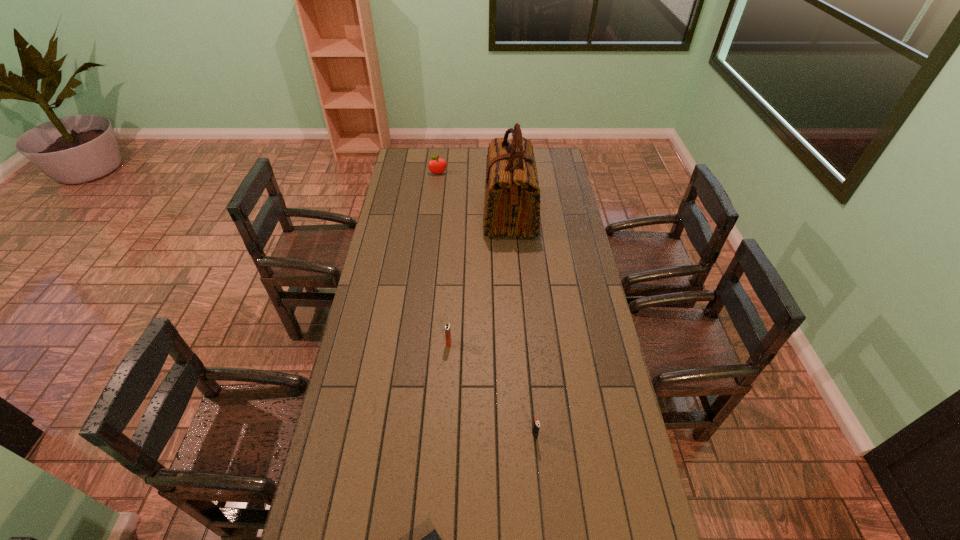
The image size is (960, 540). Identify the location of vacant space situated on the front of the apple. (434, 213).

Find the location of a particular element. The height and width of the screenshot is (540, 960). free space located on the front of the third farthest object is located at coordinates (446, 376).

Where is `free location located on the back of the shorter igniter`? The height and width of the screenshot is (540, 960). free location located on the back of the shorter igniter is located at coordinates point(525,332).

Find the location of a particular element. This screenshot has width=960, height=540. vacant region at the far edge of the desktop is located at coordinates (483, 148).

Where is `vacant space at the left edge of the desktop`? vacant space at the left edge of the desktop is located at coordinates (407, 271).

The width and height of the screenshot is (960, 540). In the image, there is a desktop. What are the coordinates of `vacant space at the right edge` in the screenshot? It's located at (582, 263).

Locate an element on the screen. Image resolution: width=960 pixels, height=540 pixels. free spot at the far right corner of the desktop is located at coordinates (x=560, y=153).

This screenshot has height=540, width=960. In order to click on empty space between the shopping bag and the apple in this screenshot , I will do `click(474, 194)`.

Identify the location of free space between the shopping bag and the left igniter. The width and height of the screenshot is (960, 540). (479, 278).

At what (x,y) coordinates should I click in order to perform the action: click on free space between the farthest object and the shopping bag. Please return your answer as a coordinate pair (x, y). The height and width of the screenshot is (540, 960). Looking at the image, I should click on (474, 194).